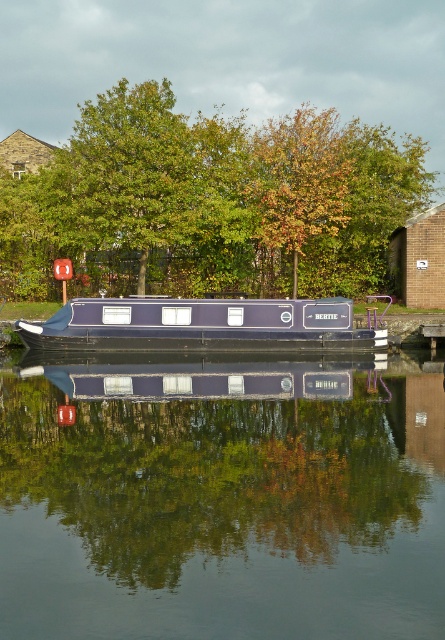
Question: Which of the following is the closest to the observer?

Choices:
 (A) (68, 256)
 (B) (363, 346)
 (C) (57, 449)

Answer: (C)

Question: Can you confirm if glossy dark blue boat at center is positioned below green leafy tree at center?

Choices:
 (A) no
 (B) yes

Answer: (B)

Question: Among these objects, which one is farthest from the camera?

Choices:
 (A) glossy dark blue boat at center
 (B) green leafy tree at center
 (C) matte blue barge at center

Answer: (B)

Question: Is green leafy tree at center thinner than matte blue barge at center?

Choices:
 (A) yes
 (B) no

Answer: (B)

Question: Is green leafy tree at center wider than matte blue barge at center?

Choices:
 (A) no
 (B) yes

Answer: (B)

Question: Considering the real-world distances, which object is closest to the green leafy tree at center?

Choices:
 (A) glossy dark blue boat at center
 (B) matte blue barge at center

Answer: (B)